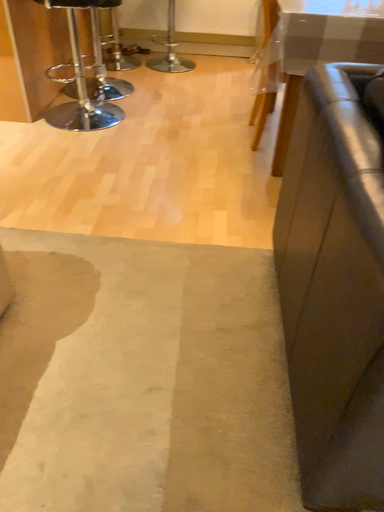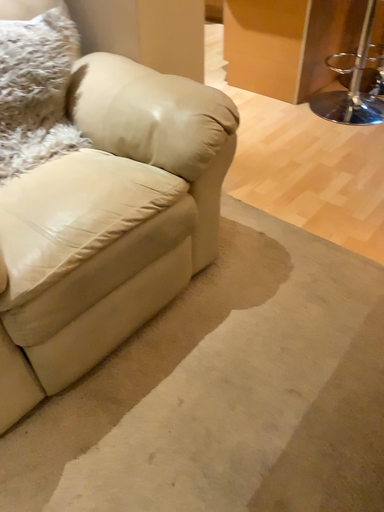
Question: How did the camera likely rotate when shooting the video?

Choices:
 (A) rotated right
 (B) rotated left

Answer: (B)